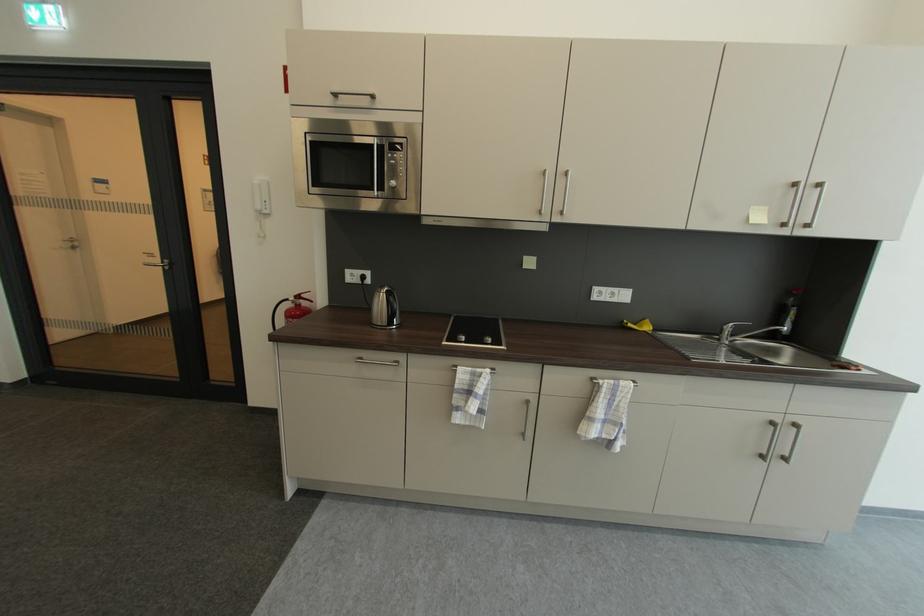
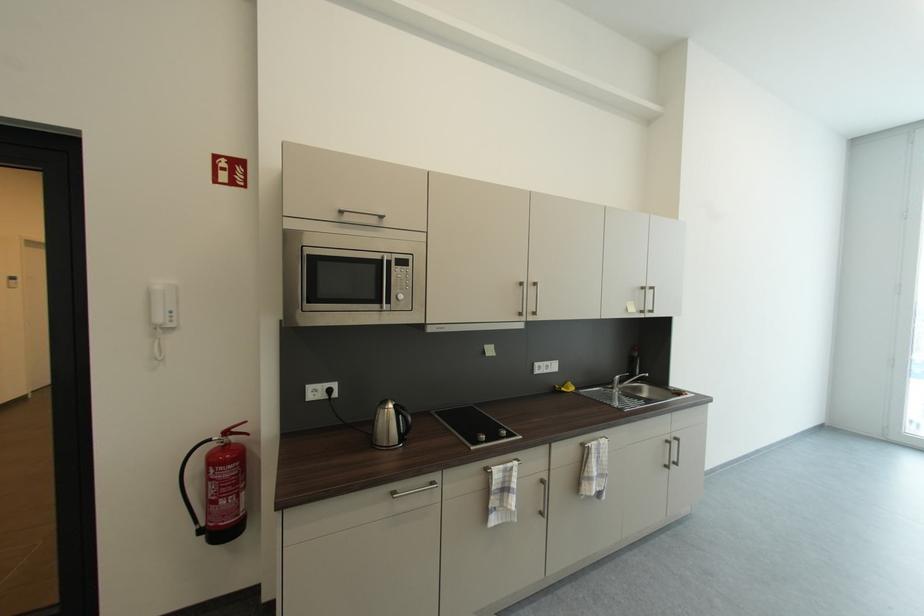
In the second image, find the point that corresponds to point 307,306 in the first image.

(237, 444)